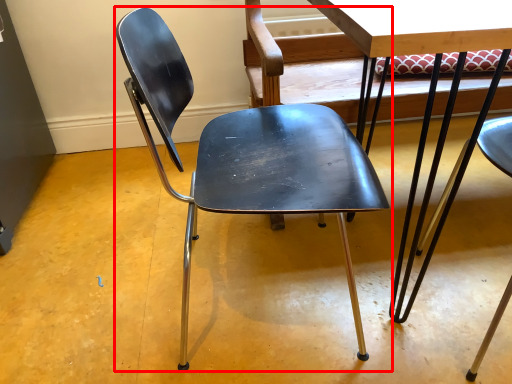
Question: From the image's perspective, what is the correct spatial relationship of chair (annotated by the red box) in relation to table?

Choices:
 (A) above
 (B) below

Answer: (B)